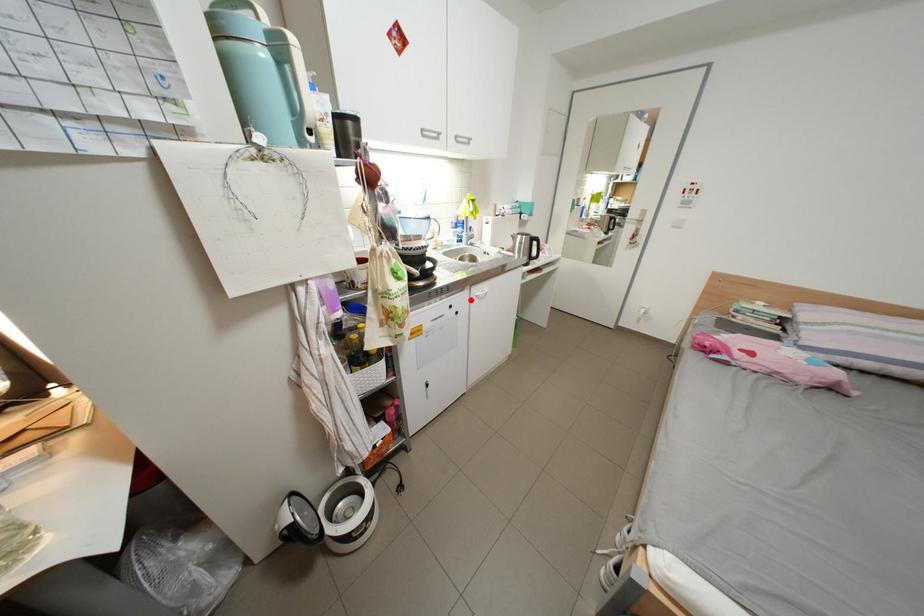
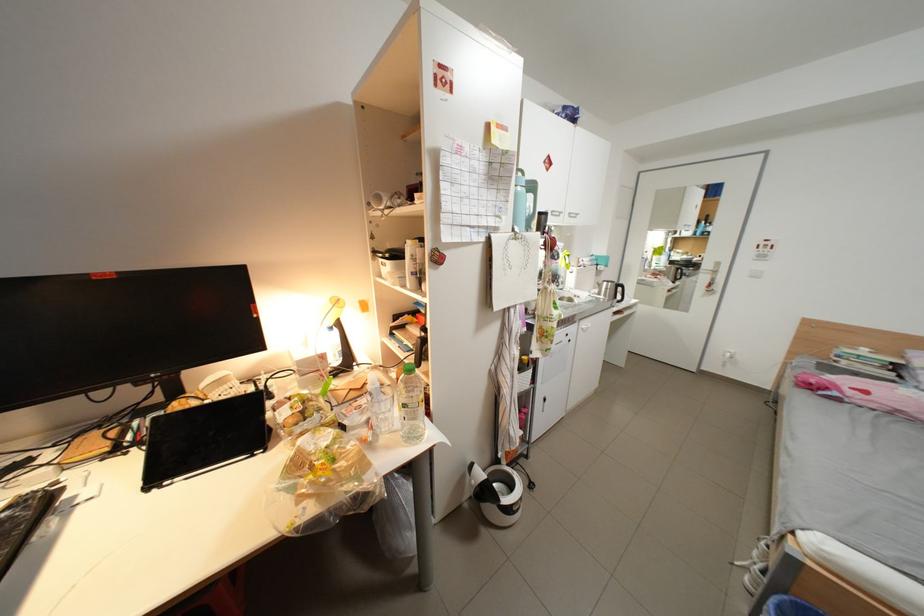
Locate, in the second image, the point that corresponds to the highlighted location in the first image.

(582, 331)